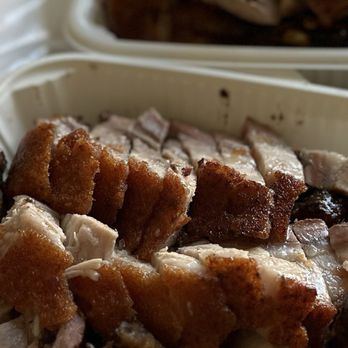
Where is `top tray`? top tray is located at coordinates click(x=80, y=31).